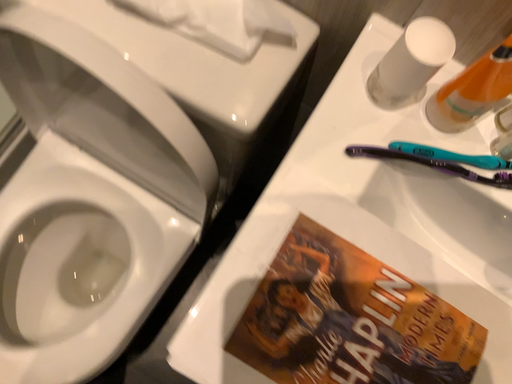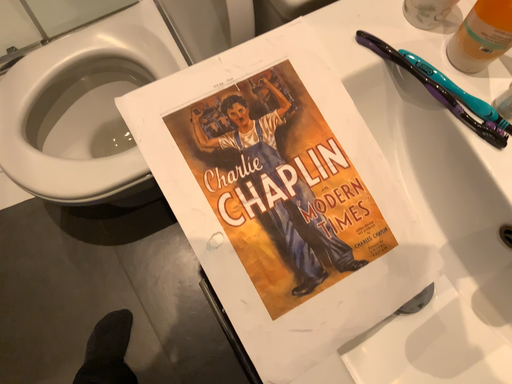
Question: How did the camera likely rotate when shooting the video?

Choices:
 (A) rotated left
 (B) rotated right

Answer: (A)